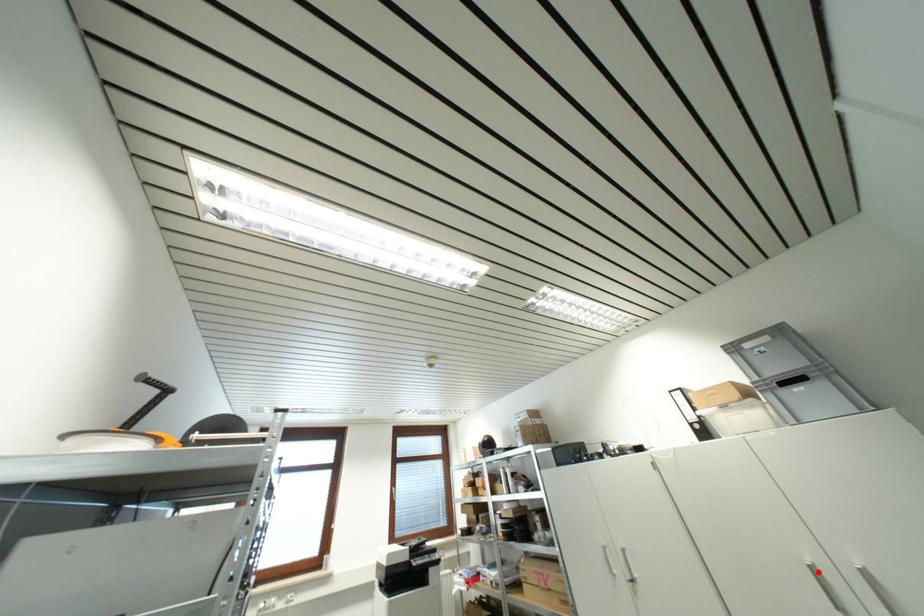
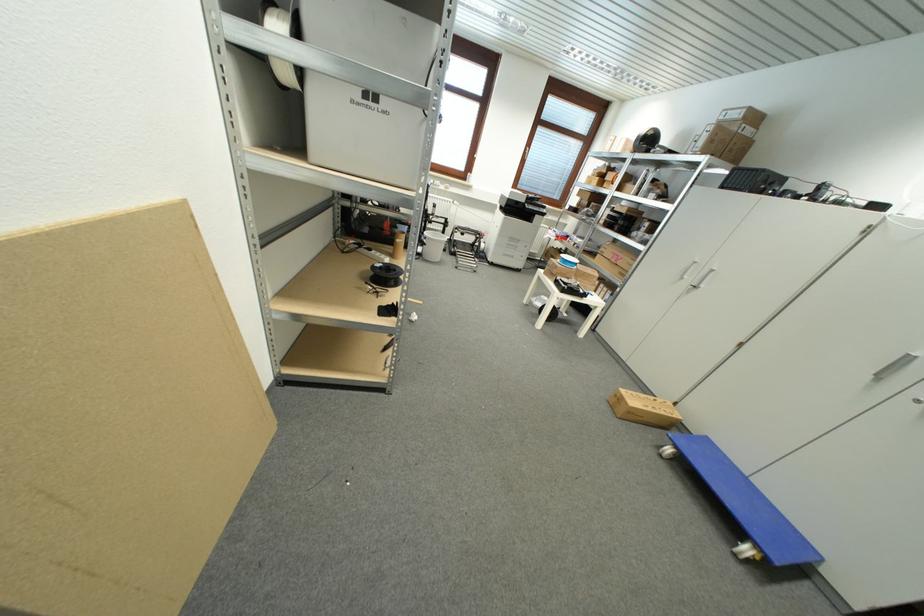
Question: I am providing you with two images of the same scene from different viewpoints. In image1, a red point is highlighted. Considering the same 3D point in image2, which of the following is correct?

Choices:
 (A) It is closer
 (B) It is farther

Answer: (B)